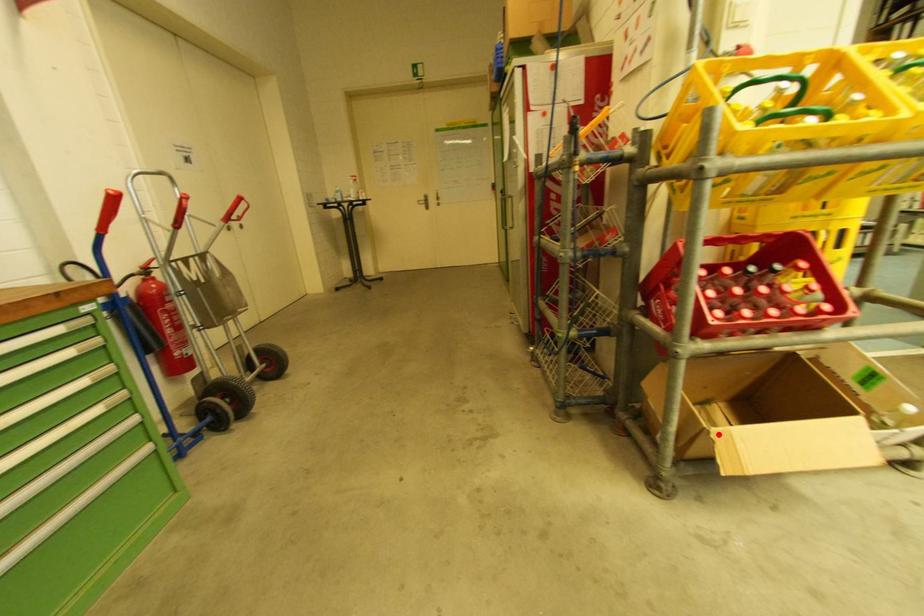
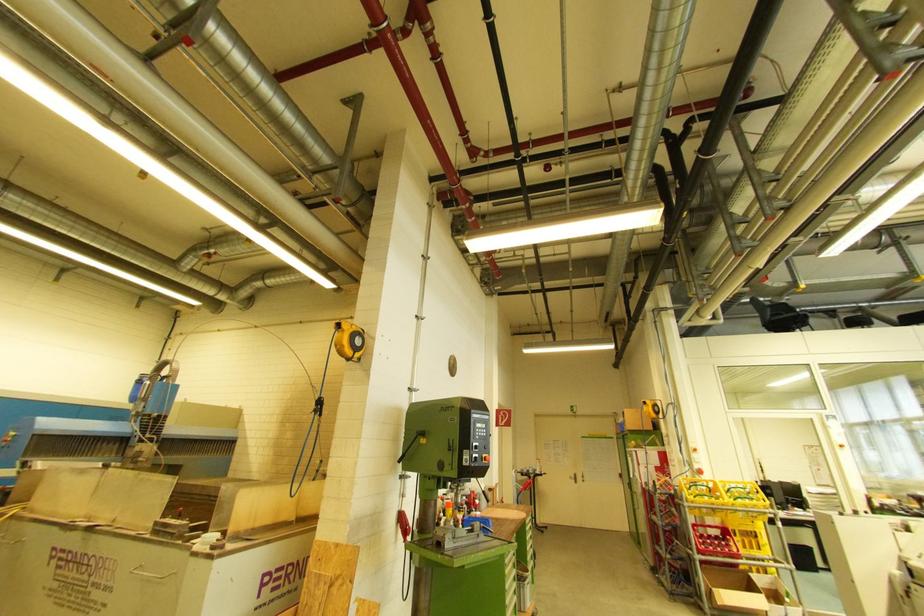
Where in the second image is the point corresponding to the highlighted location from the first image?

(716, 593)